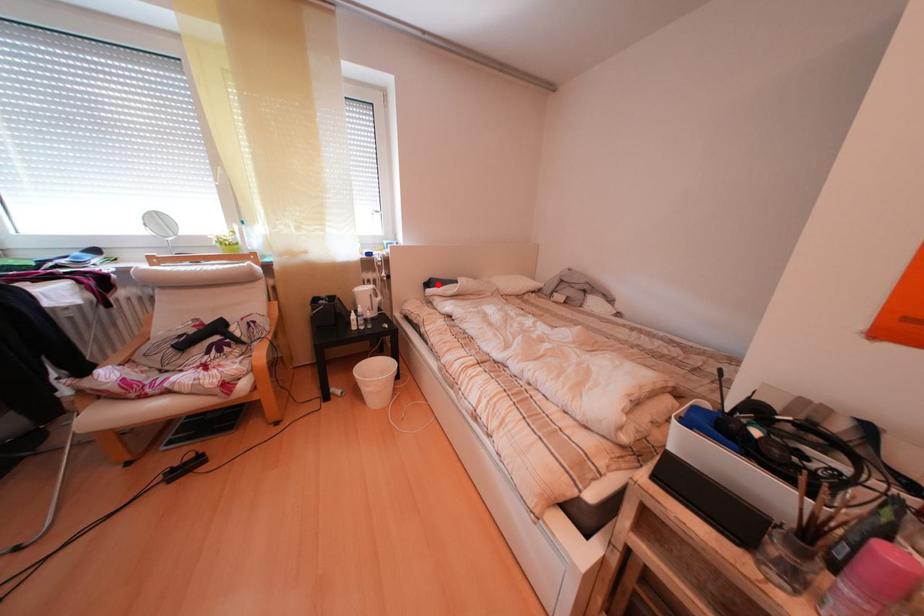
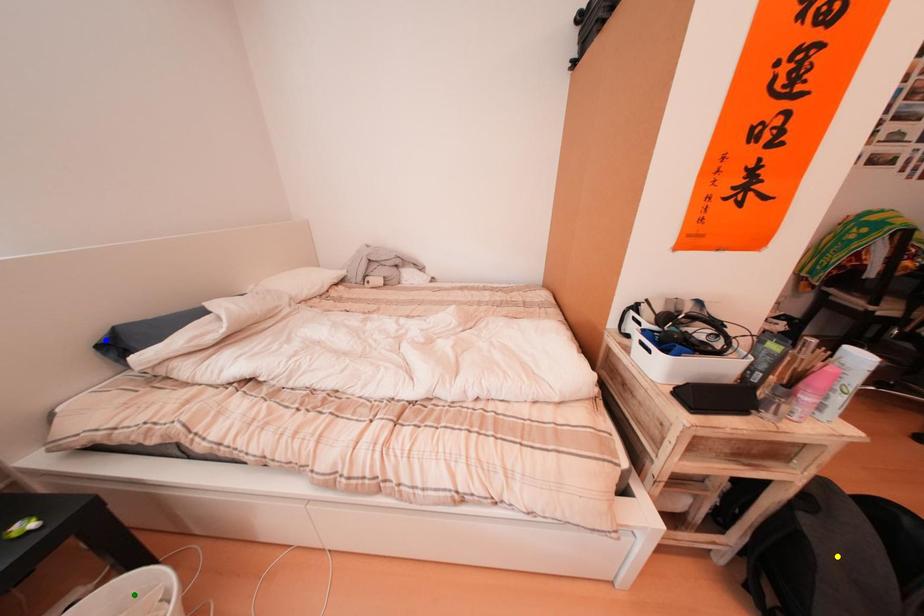
Question: I am providing you with two images of the same scene from different viewpoints. A red point is marked on the first image. You are given multiple points on the second image. Which mark in image 2 goes with the point in image 1?

Choices:
 (A) blue point
 (B) green point
 (C) yellow point

Answer: (A)